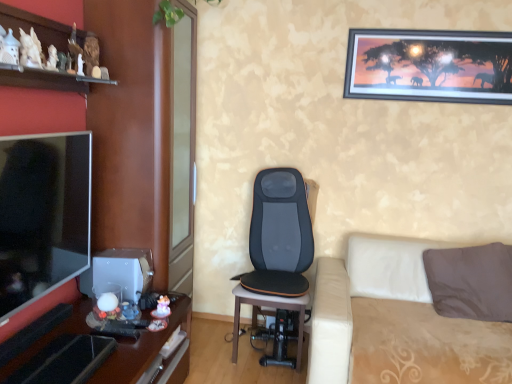
Question: Considering the relative sizes of white ceramic figurines at upper left and beige fabric studio couch at lower right in the image provided, is white ceramic figurines at upper left shorter than beige fabric studio couch at lower right?

Choices:
 (A) no
 (B) yes

Answer: (B)

Question: From the image's perspective, is white ceramic figurines at upper left beneath beige fabric studio couch at lower right?

Choices:
 (A) yes
 (B) no

Answer: (B)

Question: Does white ceramic figurines at upper left have a greater height compared to beige fabric studio couch at lower right?

Choices:
 (A) no
 (B) yes

Answer: (A)

Question: Is beige fabric studio couch at lower right located within white ceramic figurines at upper left?

Choices:
 (A) no
 (B) yes

Answer: (A)

Question: Does white ceramic figurines at upper left appear on the left side of beige fabric studio couch at lower right?

Choices:
 (A) yes
 (B) no

Answer: (A)

Question: Is matte wood entertainment center at left in front of or behind wooden glossy desk at left in the image?

Choices:
 (A) front
 (B) behind

Answer: (B)

Question: From their relative heights in the image, would you say matte wood entertainment center at left is taller or shorter than wooden glossy desk at left?

Choices:
 (A) tall
 (B) short

Answer: (A)

Question: Does point (97, 148) appear closer or farther from the camera than point (59, 344)?

Choices:
 (A) farther
 (B) closer

Answer: (A)

Question: Which is correct: matte wood entertainment center at left is inside wooden glossy desk at left, or outside of it?

Choices:
 (A) inside
 (B) outside

Answer: (B)

Question: Considering the positions of metallic-framed picture at upper right and white ceramic figurines at upper left in the image, is metallic-framed picture at upper right taller or shorter than white ceramic figurines at upper left?

Choices:
 (A) tall
 (B) short

Answer: (A)

Question: In terms of width, does metallic-framed picture at upper right look wider or thinner when compared to white ceramic figurines at upper left?

Choices:
 (A) wide
 (B) thin

Answer: (B)

Question: Looking at the image, does metallic-framed picture at upper right seem bigger or smaller compared to white ceramic figurines at upper left?

Choices:
 (A) small
 (B) big

Answer: (A)

Question: In the image, is metallic-framed picture at upper right on the left side or the right side of white ceramic figurines at upper left?

Choices:
 (A) left
 (B) right

Answer: (B)

Question: From the image's perspective, is matte black tv at left positioned above or below white ceramic figurines at upper left?

Choices:
 (A) below
 (B) above

Answer: (A)

Question: Is matte black tv at left in front of or behind white ceramic figurines at upper left in the image?

Choices:
 (A) front
 (B) behind

Answer: (B)